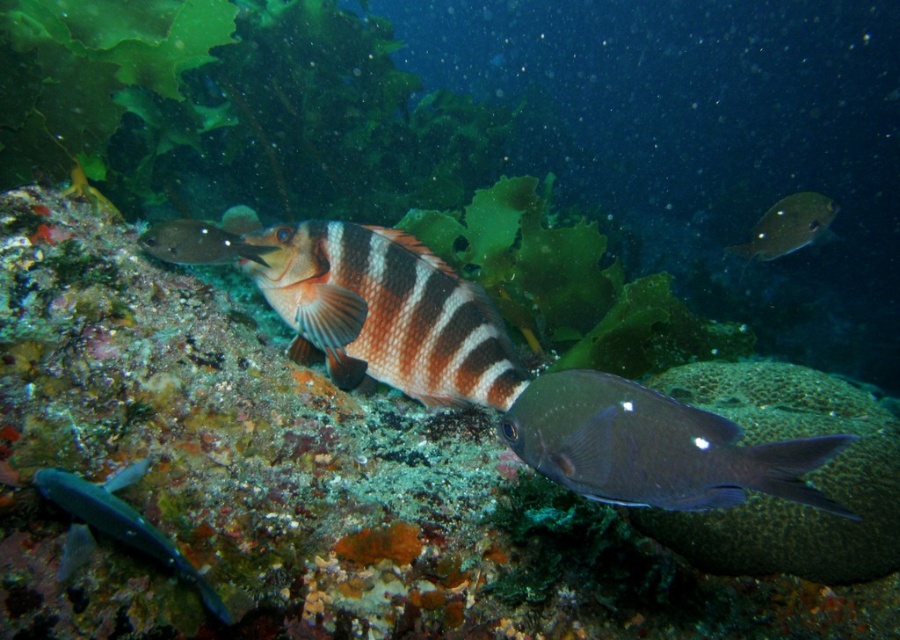
You are a marine biologist studying the spatial relationships between fish in this underwater scene. Given that the shiny blue fish at lower left and the shiny silver fish at upper left are both part of a school, how far apart are they from each other?

The shiny blue fish at lower left is 18.28 inches from the shiny silver fish at upper left.

Based on the coordinates provided in the scene, where exactly is the shiny dark blue fish at center located?

The shiny dark blue fish at center is located at point [653,448].

You are a marine biologist observing this underwater scene. You notice the shiny dark blue fish at center and the shiny blue fish at lower left. Which fish is positioned closer to your viewpoint?

The shiny dark blue fish at center is closer to the viewer than the shiny blue fish at lower left.